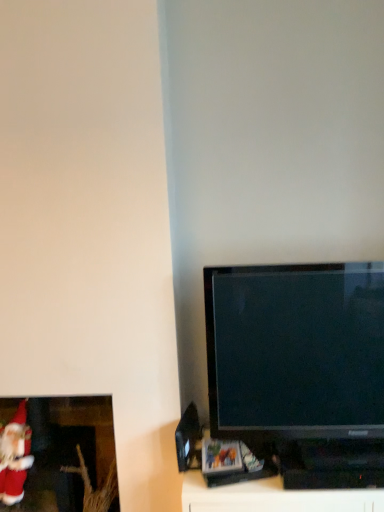
Question: Does velvet red santa claus at lower left have a larger size compared to black glossy tv at right?

Choices:
 (A) yes
 (B) no

Answer: (B)

Question: Is velvet red santa claus at lower left smaller than black glossy tv at right?

Choices:
 (A) no
 (B) yes

Answer: (B)

Question: From the image's perspective, would you say velvet red santa claus at lower left is shown under black glossy tv at right?

Choices:
 (A) yes
 (B) no

Answer: (A)

Question: Is velvet red santa claus at lower left to the right of black glossy tv at right from the viewer's perspective?

Choices:
 (A) yes
 (B) no

Answer: (B)

Question: Can you confirm if velvet red santa claus at lower left is taller than black glossy tv at right?

Choices:
 (A) yes
 (B) no

Answer: (B)

Question: Looking at the image, does black glossy tv at right seem bigger or smaller compared to matte red santa at lower left?

Choices:
 (A) big
 (B) small

Answer: (B)

Question: Considering the positions of black glossy tv at right and matte red santa at lower left in the image, is black glossy tv at right taller or shorter than matte red santa at lower left?

Choices:
 (A) short
 (B) tall

Answer: (A)

Question: Do you think black glossy tv at right is within matte red santa at lower left, or outside of it?

Choices:
 (A) outside
 (B) inside

Answer: (A)

Question: Is point (231, 387) positioned closer to the camera than point (19, 468)?

Choices:
 (A) closer
 (B) farther

Answer: (B)

Question: Considering the relative positions of velvet red santa claus at lower left and black glossy tv at right in the image provided, is velvet red santa claus at lower left to the left or to the right of black glossy tv at right?

Choices:
 (A) left
 (B) right

Answer: (A)

Question: From a real-world perspective, is velvet red santa claus at lower left physically located above or below black glossy tv at right?

Choices:
 (A) above
 (B) below

Answer: (B)

Question: In terms of height, does velvet red santa claus at lower left look taller or shorter compared to black glossy tv at right?

Choices:
 (A) tall
 (B) short

Answer: (B)

Question: Based on their sizes in the image, would you say velvet red santa claus at lower left is bigger or smaller than black glossy tv at right?

Choices:
 (A) big
 (B) small

Answer: (B)

Question: Is matte red santa at lower left taller or shorter than black glossy tv at right?

Choices:
 (A) short
 (B) tall

Answer: (B)

Question: Considering the positions of matte red santa at lower left and black glossy tv at right in the image, is matte red santa at lower left wider or thinner than black glossy tv at right?

Choices:
 (A) thin
 (B) wide

Answer: (B)